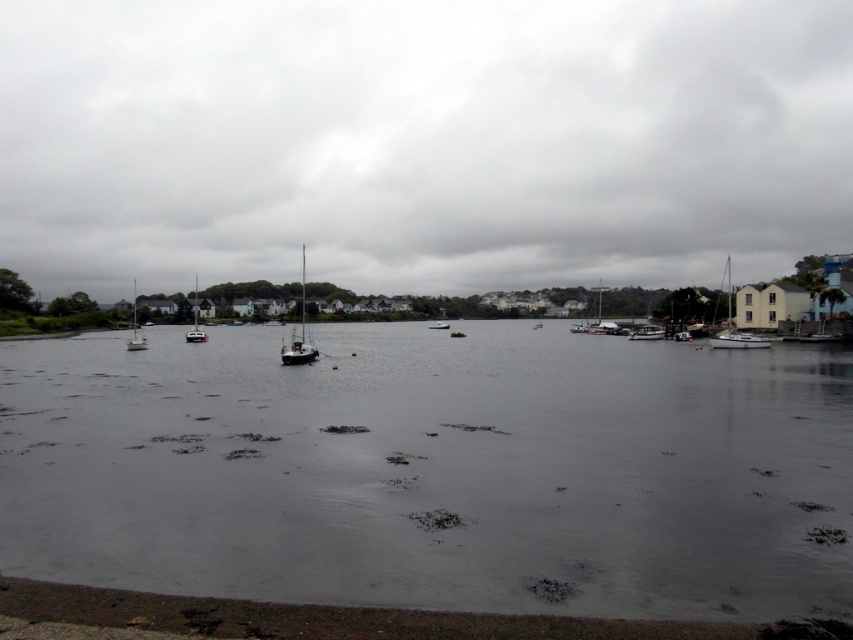
Question: Can you confirm if cloudy sky at upper center is positioned below white matte sailboat at right?

Choices:
 (A) yes
 (B) no

Answer: (B)

Question: From the image, what is the correct spatial relationship of shiny black sailboat at center in relation to white matte sailboat at left?

Choices:
 (A) above
 (B) below

Answer: (A)

Question: Which point is farther to the camera?

Choices:
 (A) cloudy sky at upper center
 (B) white plastic boat at right
 (C) gray water at center
 (D) white glossy boat at center

Answer: (A)

Question: Is cloudy sky at upper center thinner than white glossy boat at center?

Choices:
 (A) yes
 (B) no

Answer: (B)

Question: Among these objects, which one is nearest to the camera?

Choices:
 (A) white plastic sailboat at center-left
 (B) cloudy sky at upper center
 (C) white matte boat at center
 (D) shiny black sailboat at center

Answer: (D)

Question: Which of the following is the closest to the observer?

Choices:
 (A) (595, 330)
 (B) (196, 339)
 (C) (495, 509)
 (D) (143, 336)

Answer: (C)